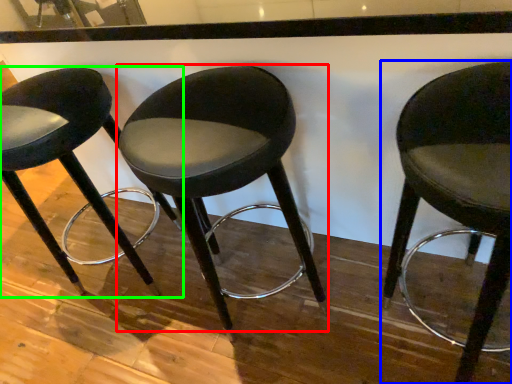
Question: Which is farther away from chair (highlighted by a red box)? chair (highlighted by a blue box) or chair (highlighted by a green box)?

Choices:
 (A) chair
 (B) chair

Answer: (B)